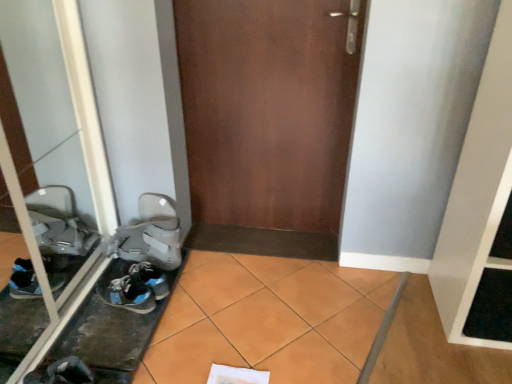
Question: Is the depth of transparent glass door at left greater than that of dark gray fabric sneaker at lower left, the 1th footwear from the bottom?

Choices:
 (A) yes
 (B) no

Answer: (B)

Question: Does transparent glass door at left appear on the right side of dark gray fabric sneaker at lower left, marked as the 3th footwear in a top-to-bottom arrangement?

Choices:
 (A) yes
 (B) no

Answer: (B)

Question: Can you confirm if transparent glass door at left is bigger than dark gray fabric sneaker at lower left, which is the 1th footwear in front-to-back order?

Choices:
 (A) no
 (B) yes

Answer: (B)

Question: Considering the relative sizes of transparent glass door at left and dark gray fabric sneaker at lower left, marked as the 3th footwear in a top-to-bottom arrangement, in the image provided, is transparent glass door at left smaller than dark gray fabric sneaker at lower left, marked as the 3th footwear in a top-to-bottom arrangement,?

Choices:
 (A) yes
 (B) no

Answer: (B)

Question: Considering the relative sizes of transparent glass door at left and dark gray fabric sneaker at lower left, the 1th footwear from the bottom, in the image provided, is transparent glass door at left wider than dark gray fabric sneaker at lower left, the 1th footwear from the bottom,?

Choices:
 (A) no
 (B) yes

Answer: (A)

Question: Is transparent glass door at left oriented towards dark gray fabric sneaker at lower left, which appears as the third footwear when viewed from the back?

Choices:
 (A) no
 (B) yes

Answer: (B)

Question: Are dark gray fabric sneaker at lower left, which appears as the third footwear when viewed from the back, and brown matte door at center beside each other?

Choices:
 (A) no
 (B) yes

Answer: (A)

Question: Does dark gray fabric sneaker at lower left, marked as the 3th footwear in a top-to-bottom arrangement, have a greater width compared to brown matte door at center?

Choices:
 (A) yes
 (B) no

Answer: (A)

Question: Is dark gray fabric sneaker at lower left, which appears as the third footwear when viewed from the back, behind brown matte door at center?

Choices:
 (A) yes
 (B) no

Answer: (B)

Question: Does dark gray fabric sneaker at lower left, which is the 1th footwear in front-to-back order, have a larger size compared to brown matte door at center?

Choices:
 (A) yes
 (B) no

Answer: (B)

Question: Is dark gray fabric sneaker at lower left, the 1th footwear from the bottom, facing towards brown matte door at center?

Choices:
 (A) yes
 (B) no

Answer: (B)

Question: From a real-world perspective, is dark gray fabric sneaker at lower left, which appears as the third footwear when viewed from the back, over brown matte door at center?

Choices:
 (A) yes
 (B) no

Answer: (B)

Question: Is dark gray fabric sneaker at lower left, which is the 1th footwear in front-to-back order, positioned with its back to transparent glass door at left?

Choices:
 (A) no
 (B) yes

Answer: (B)